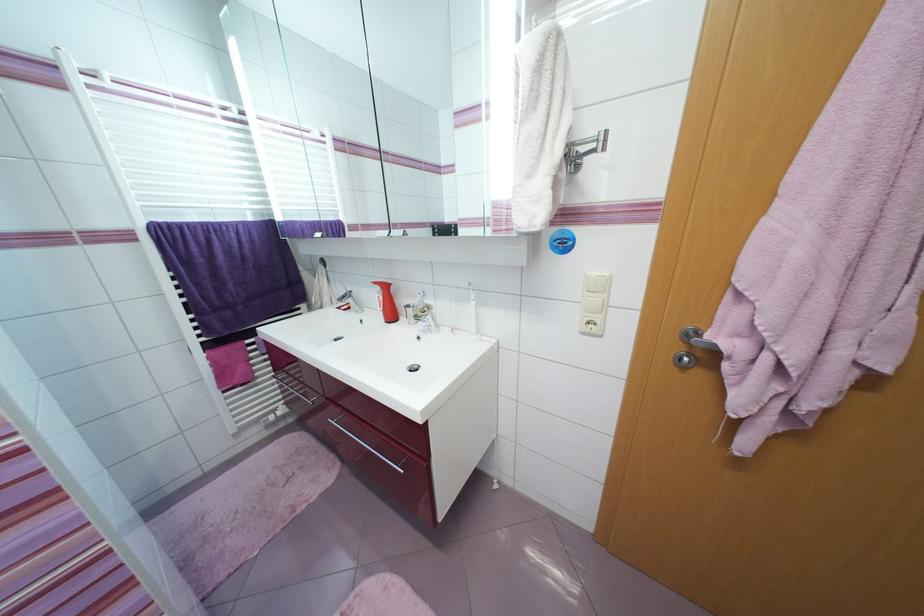
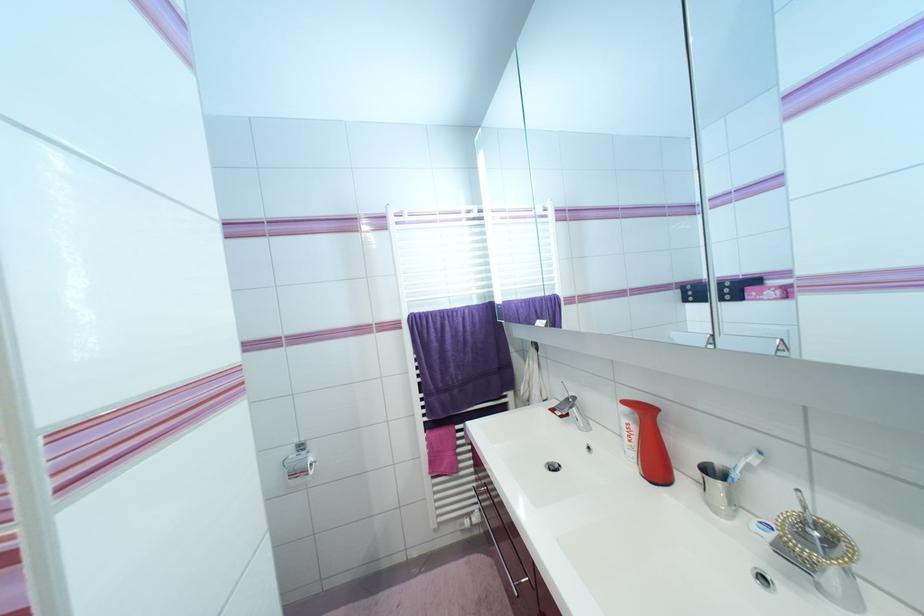
Question: Based on the continuous images, in which direction is the camera rotating? Reply with the corresponding letter.

Choices:
 (A) Left
 (B) Right
 (C) Up
 (D) Down

Answer: (A)